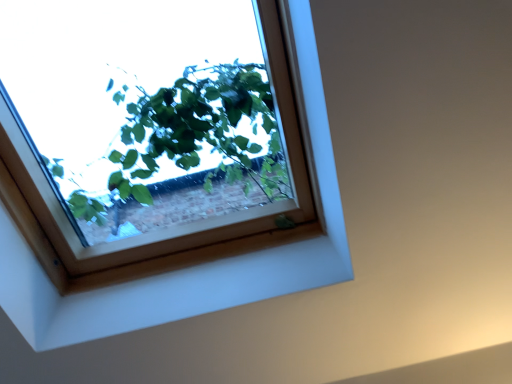
Describe the element at coordinates (191, 264) in the screenshot. I see `wooden frame at upper left` at that location.

At what (x,y) coordinates should I click in order to perform the action: click on wooden frame at upper left. Please return your answer as a coordinate pair (x, y). This screenshot has height=384, width=512. Looking at the image, I should click on (191, 264).

Find the location of a particular element. This screenshot has height=384, width=512. wooden frame at upper left is located at coordinates (191, 264).